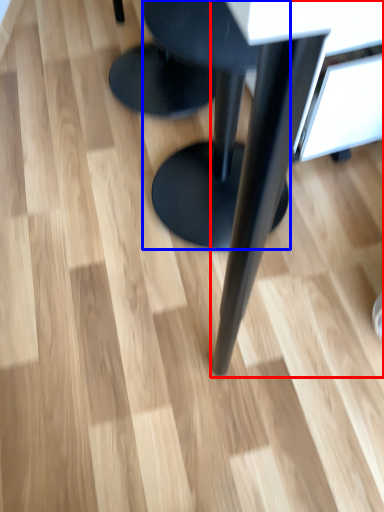
Question: Which object is further to the camera taking this photo, table (highlighted by a red box) or stool (highlighted by a blue box)?

Choices:
 (A) table
 (B) stool

Answer: (B)